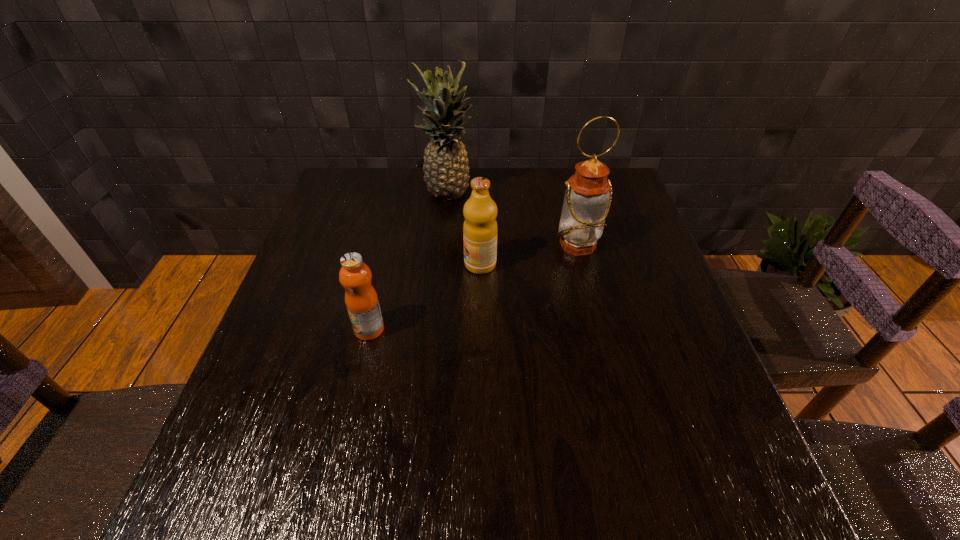
Where is `vacant space that's between the farthest object and the leftmost object`? vacant space that's between the farthest object and the leftmost object is located at coordinates (408, 262).

Where is `vacant space that's between the right fruit juice and the left fruit juice`? This screenshot has width=960, height=540. vacant space that's between the right fruit juice and the left fruit juice is located at coordinates (424, 297).

Find the location of a particular element. free area in between the farther fruit juice and the oil lamp is located at coordinates click(529, 255).

This screenshot has width=960, height=540. I want to click on free space that is in between the farthest object and the leftmost object, so tap(408, 262).

Find the location of a particular element. This screenshot has height=540, width=960. vacant space in between the rightmost object and the pineapple is located at coordinates pyautogui.click(x=513, y=220).

You are a GUI agent. You are given a task and a screenshot of the screen. Output one action in this format:
    pyautogui.click(x=<x>, y=<y>)
    Task: Click on the vacant region between the oil lamp and the right fruit juice
    The image size is (960, 540).
    Given the screenshot: What is the action you would take?
    pyautogui.click(x=529, y=255)

The image size is (960, 540). Find the location of `free area in between the oil lamp and the farthest object`. free area in between the oil lamp and the farthest object is located at coordinates (513, 220).

Where is `vacant area between the rightmost object and the farther fruit juice`? The height and width of the screenshot is (540, 960). vacant area between the rightmost object and the farther fruit juice is located at coordinates (529, 255).

Where is `vacant point located between the shortest object and the pineapple`? vacant point located between the shortest object and the pineapple is located at coordinates (408, 262).

Identify which object is the second closest to the pineapple. Please provide its 2D coordinates. Your answer should be formatted as a tuple, i.e. [(x, y)], where the tuple contains the x and y coordinates of a point satisfying the conditions above.

[(588, 194)]